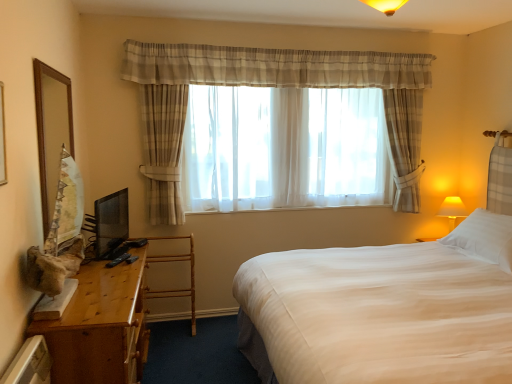
Question: Is wooden desk at left spatially inside sheer white curtain at center, or outside of it?

Choices:
 (A) inside
 (B) outside

Answer: (B)

Question: In terms of width, does wooden desk at left look wider or thinner when compared to sheer white curtain at center?

Choices:
 (A) wide
 (B) thin

Answer: (A)

Question: Based on their relative distances, which object is nearer to the white soft bed at center?

Choices:
 (A) matte yellow plastic table lamp at right
 (B) sheer white curtain at center
 (C) bamboo rack at left
 (D) white soft pillow at upper right
 (E) sheer fabric bay window at center

Answer: (D)

Question: Which of these objects is positioned farthest from the bamboo rack at left?

Choices:
 (A) white soft pillow at upper right
 (B) white soft bed at center
 (C) sheer fabric bay window at center
 (D) matte yellow plastic table lamp at right
 (E) white plastic radiator at lower left

Answer: (D)